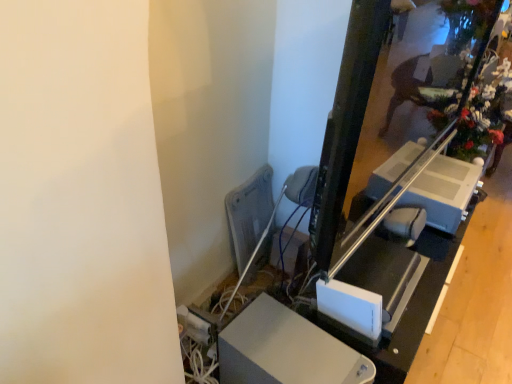
Question: Is white plastic table at center thinner than white plastic lift at right?

Choices:
 (A) yes
 (B) no

Answer: (B)

Question: Considering the relative sizes of white plastic table at center and white plastic lift at right in the image provided, is white plastic table at center wider than white plastic lift at right?

Choices:
 (A) yes
 (B) no

Answer: (A)

Question: From the image's perspective, is white plastic table at center above white plastic lift at right?

Choices:
 (A) no
 (B) yes

Answer: (A)

Question: Is white plastic table at center not inside white plastic lift at right?

Choices:
 (A) yes
 (B) no

Answer: (A)

Question: Would you consider white plastic table at center to be distant from white plastic lift at right?

Choices:
 (A) yes
 (B) no

Answer: (B)

Question: Is white plastic table at center bigger than white plastic lift at right?

Choices:
 (A) yes
 (B) no

Answer: (A)

Question: Is gray metallic radiator at center to the right of white plastic table at center from the viewer's perspective?

Choices:
 (A) yes
 (B) no

Answer: (B)

Question: From the image's perspective, is gray metallic radiator at center beneath white plastic table at center?

Choices:
 (A) no
 (B) yes

Answer: (A)

Question: Is gray metallic radiator at center positioned far away from white plastic table at center?

Choices:
 (A) yes
 (B) no

Answer: (B)

Question: Considering the relative sizes of gray metallic radiator at center and white plastic table at center in the image provided, is gray metallic radiator at center bigger than white plastic table at center?

Choices:
 (A) yes
 (B) no

Answer: (B)

Question: Does gray metallic radiator at center have a lesser height compared to white plastic table at center?

Choices:
 (A) yes
 (B) no

Answer: (B)

Question: Is white plastic table at center a part of gray metallic radiator at center?

Choices:
 (A) yes
 (B) no

Answer: (B)

Question: Are white plastic speaker at center and white plastic table at center located far from each other?

Choices:
 (A) no
 (B) yes

Answer: (A)